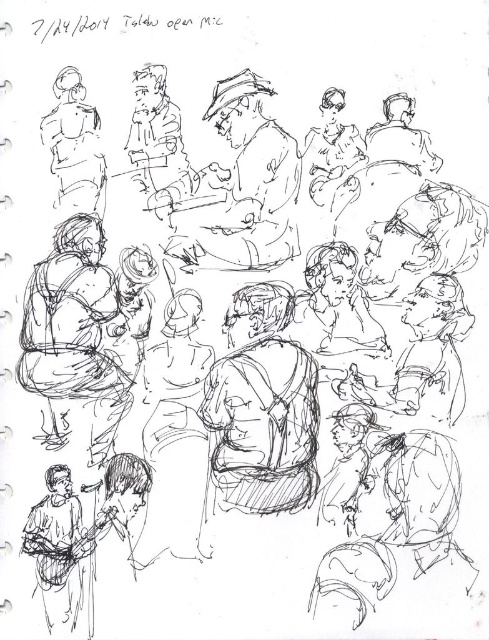
Can you confirm if smooth brown jacket at center is positioned below matte black figure at upper left?

Indeed, smooth brown jacket at center is positioned under matte black figure at upper left.

Who is more distant from viewer, (234, 262) or (57, 160)?

The point (234, 262) is behind.

Which is in front, point (248, 220) or point (43, 141)?

Point (43, 141) is in front.

This screenshot has width=489, height=640. I want to click on smooth brown jacket at center, so click(x=239, y=188).